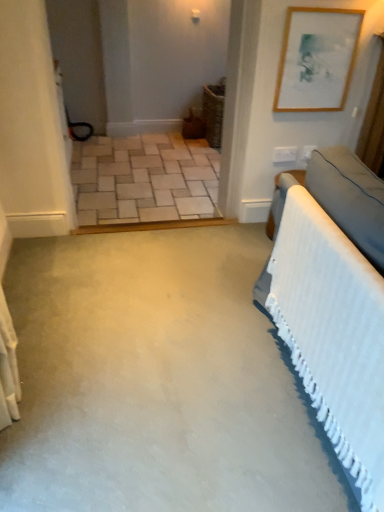
Describe the element at coordinates (144, 179) in the screenshot. The image size is (384, 512). I see `beige brick floor at center` at that location.

What are the coordinates of `wooden picture frame at upper right` in the screenshot? It's located at (317, 59).

How far apart are velvet grey bed at right and wooden picture frame at upper right?

velvet grey bed at right and wooden picture frame at upper right are 1.13 meters apart from each other.

Which is farther from the camera, (322, 174) or (347, 67)?

Positioned behind is point (347, 67).

Based on the photo, is velvet grey bed at right directly adjacent to wooden picture frame at upper right?

velvet grey bed at right and wooden picture frame at upper right are not in contact.

Could you tell me if velvet grey bed at right is facing wooden picture frame at upper right?

No, velvet grey bed at right is not facing towards wooden picture frame at upper right.

Is beige brick floor at center in front of wooden picture frame at upper right?

No, beige brick floor at center is further to the viewer.

At what (x,y) coordinates should I click in order to perform the action: click on picture frame positioned vertically above the beige brick floor at center (from a real-world perspective). Please return your answer as a coordinate pair (x, y). The width and height of the screenshot is (384, 512). Looking at the image, I should click on (317, 59).

Is wooden picture frame at upper right surrounded by beige brick floor at center?

That's incorrect, wooden picture frame at upper right is not inside beige brick floor at center.

Does wooden picture frame at upper right have a lesser height compared to beige brick floor at center?

No.

Is wooden picture frame at upper right facing away from beige brick floor at center?

No, wooden picture frame at upper right is not facing the opposite direction of beige brick floor at center.

Can you confirm if wooden picture frame at upper right is thinner than beige brick floor at center?

Yes.

Considering the relative sizes of velvet grey bed at right and beige brick floor at center in the image provided, is velvet grey bed at right wider than beige brick floor at center?

No, velvet grey bed at right is not wider than beige brick floor at center.

You are a GUI agent. You are given a task and a screenshot of the screen. Output one action in this format:
    pyautogui.click(x=<x>, y=<y>)
    Task: Click on the concrete lying behind the velvet grey bed at right
    
    Given the screenshot: What is the action you would take?
    pyautogui.click(x=144, y=179)

From the image's perspective, which one is positioned lower, velvet grey bed at right or beige brick floor at center?

velvet grey bed at right, from the image's perspective.

From the image's perspective, is wooden picture frame at upper right positioned above or below velvet grey bed at right?

Based on their image positions, wooden picture frame at upper right is located above velvet grey bed at right.

Is wooden picture frame at upper right facing away from velvet grey bed at right?

No, wooden picture frame at upper right is not facing away from velvet grey bed at right.

In the scene shown: Who is taller, beige brick floor at center or velvet grey bed at right?

With more height is velvet grey bed at right.

From a real-world perspective, between beige brick floor at center and velvet grey bed at right, who is vertically lower?

beige brick floor at center.

From the picture: Considering the sizes of objects beige brick floor at center and velvet grey bed at right in the image provided, who is thinner, beige brick floor at center or velvet grey bed at right?

Thinner between the two is velvet grey bed at right.

From the image's perspective, which is above, beige brick floor at center or velvet grey bed at right?

beige brick floor at center, from the image's perspective.

Identify the location of picture frame behind the velvet grey bed at right. The width and height of the screenshot is (384, 512). (317, 59).

Where is `picture frame lying in front of the beige brick floor at center`? picture frame lying in front of the beige brick floor at center is located at coordinates (317, 59).

When comparing their distances from wooden picture frame at upper right, does beige brick floor at center or velvet grey bed at right seem closer?

Based on the image, velvet grey bed at right appears to be nearer to wooden picture frame at upper right.

Estimate the real-world distances between objects in this image. Which object is closer to beige brick floor at center, velvet grey bed at right or wooden picture frame at upper right?

Among the two, wooden picture frame at upper right is located nearer to beige brick floor at center.

Estimate the real-world distances between objects in this image. Which object is further from wooden picture frame at upper right, velvet grey bed at right or beige brick floor at center?

Based on the image, beige brick floor at center appears to be further to wooden picture frame at upper right.

Which object lies further to the anchor point beige brick floor at center, wooden picture frame at upper right or velvet grey bed at right?

velvet grey bed at right is positioned further to the anchor beige brick floor at center.

Based on their spatial positions, is beige brick floor at center or wooden picture frame at upper right further from velvet grey bed at right?

The object further to velvet grey bed at right is beige brick floor at center.

Based on the photo, from the image, which object appears to be farther from velvet grey bed at right, wooden picture frame at upper right or beige brick floor at center?

Based on the image, beige brick floor at center appears to be further to velvet grey bed at right.

In order to click on picture frame between velvet grey bed at right and beige brick floor at center from front to back in this screenshot , I will do `click(317, 59)`.